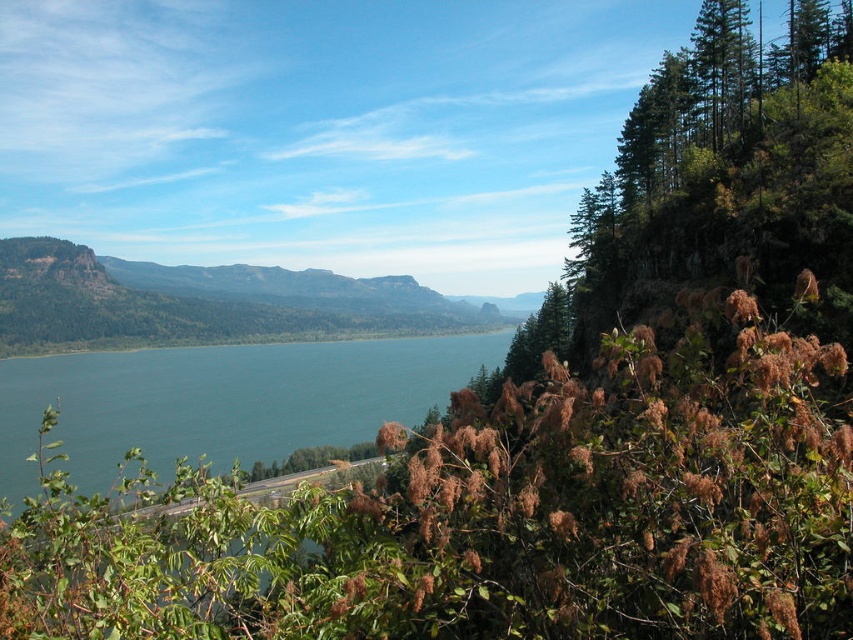
Question: Among these points, which one is farthest from the camera?

Choices:
 (A) (315, 307)
 (B) (247, 449)

Answer: (A)

Question: Considering the relative positions of blue water at center and green forested mountain at center in the image provided, where is blue water at center located with respect to green forested mountain at center?

Choices:
 (A) above
 (B) below

Answer: (B)

Question: Does blue water at center have a greater width compared to green forested mountain at center?

Choices:
 (A) no
 (B) yes

Answer: (A)

Question: Is blue water at center closer to the viewer compared to green forested mountain at center?

Choices:
 (A) yes
 (B) no

Answer: (A)

Question: Which object is closer to the camera taking this photo?

Choices:
 (A) green forested mountain at center
 (B) blue water at center

Answer: (B)